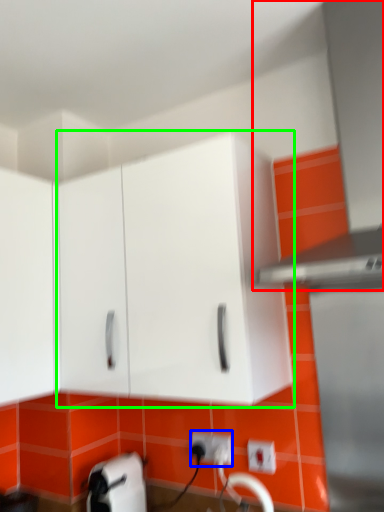
Question: Based on their relative distances, which object is nearer to exhaust hood (highlighted by a red box)? Choose from electric outlet (highlighted by a blue box) and cabinetry (highlighted by a green box).

Choices:
 (A) electric outlet
 (B) cabinetry

Answer: (B)